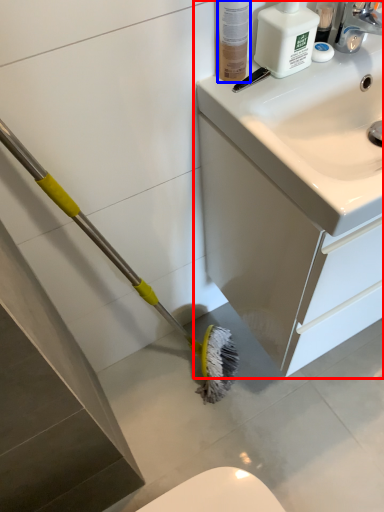
Question: Which of the following is the closest to the observer, bathroom cabinet (highlighted by a red box) or toiletry (highlighted by a blue box)?

Choices:
 (A) bathroom cabinet
 (B) toiletry

Answer: (B)